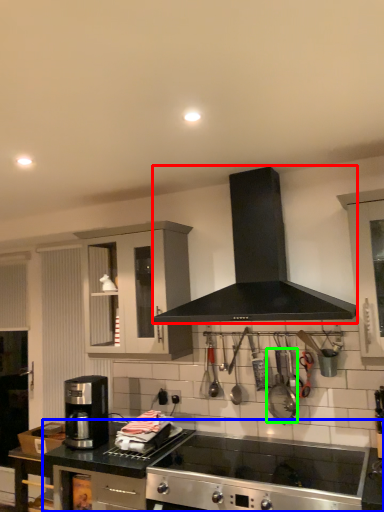
Question: Considering the real-world distances, which object is closest to kitchen appliance (highlighted by a red box)? countertop (highlighted by a blue box) or appliance (highlighted by a green box).

Choices:
 (A) countertop
 (B) appliance

Answer: (B)